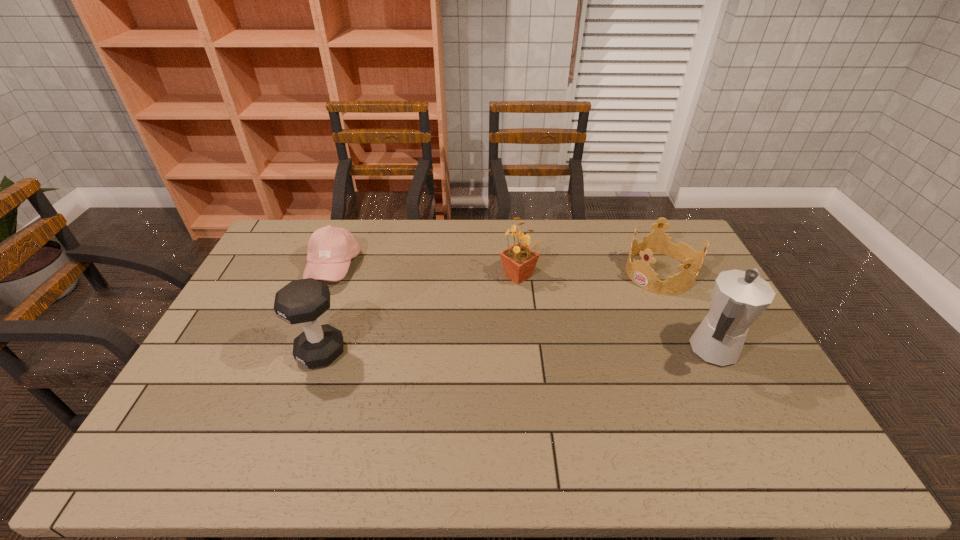
This screenshot has width=960, height=540. In order to click on blank region between the tallest object and the tiara in this screenshot , I will do `click(685, 313)`.

You are a GUI agent. You are given a task and a screenshot of the screen. Output one action in this format:
    pyautogui.click(x=<x>, y=<y>)
    Task: Click on the unoccupied area between the coffeepot and the baseball cap
    The width and height of the screenshot is (960, 540).
    Given the screenshot: What is the action you would take?
    pyautogui.click(x=522, y=310)

Locate an element on the screen. Image resolution: width=960 pixels, height=540 pixels. vacant point located between the tallest object and the baseball cap is located at coordinates (522, 310).

I want to click on free spot between the dumbbell and the tallest object, so click(x=516, y=352).

Where is `unoccupied area between the tiara and the coffeepot`? The width and height of the screenshot is (960, 540). unoccupied area between the tiara and the coffeepot is located at coordinates (685, 313).

Locate an element on the screen. free space between the tiara and the dumbbell is located at coordinates (491, 313).

Point out which object is positioned as the fourth nearest to the coffeepot. Please provide its 2D coordinates. Your answer should be formatted as a tuple, i.e. [(x, y)], where the tuple contains the x and y coordinates of a point satisfying the conditions above.

[(330, 249)]

Locate an element on the screen. the fourth closest object relative to the third object from right to left is located at coordinates (330, 249).

The width and height of the screenshot is (960, 540). I want to click on free point that satisfies the following two spatial constraints: 1. on the front side of the coffeepot; 2. on the right side of the baseball cap, so click(300, 352).

Locate an element on the screen. The image size is (960, 540). vacant point that satisfies the following two spatial constraints: 1. on the front side of the tallest object; 2. on the right side of the tiara is located at coordinates (697, 352).